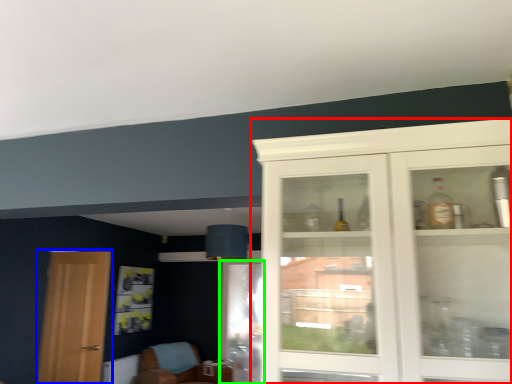
Question: Which object is the farthest from cabinetry (highlighted by a red box)? Choose among these: door (highlighted by a blue box) or screen door (highlighted by a green box).

Choices:
 (A) door
 (B) screen door

Answer: (A)